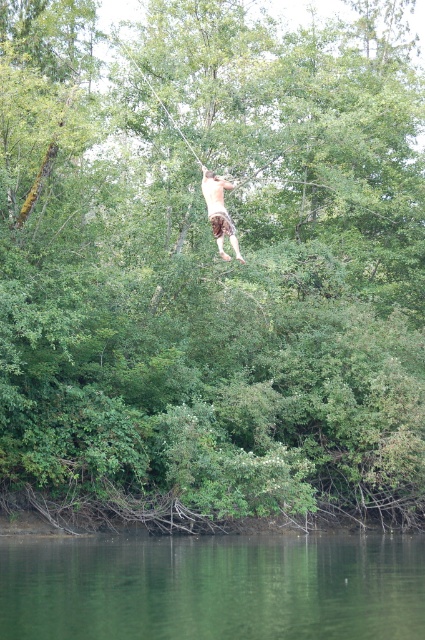
Can you confirm if brown textured shorts at center is wider than white rope at upper center?

No.

Based on the photo, does brown textured shorts at center come in front of white rope at upper center?

That is True.

Is point (220, 227) in front of point (118, 42)?

That is True.

I want to click on brown textured shorts at center, so click(x=218, y=211).

Which is more to the right, green smooth water at lower center or white rope at upper center?

Positioned to the right is green smooth water at lower center.

Between point (365, 582) and point (155, 93), which one is positioned behind?

Point (155, 93)

The height and width of the screenshot is (640, 425). Describe the element at coordinates (212, 588) in the screenshot. I see `green smooth water at lower center` at that location.

The image size is (425, 640). Identify the location of green smooth water at lower center. (212, 588).

Does green smooth water at lower center appear on the right side of brown textured shorts at center?

No, green smooth water at lower center is not to the right of brown textured shorts at center.

Which is below, green smooth water at lower center or brown textured shorts at center?

green smooth water at lower center

At what (x,y) coordinates should I click in order to perform the action: click on green smooth water at lower center. Please return your answer as a coordinate pair (x, y). Looking at the image, I should click on [x=212, y=588].